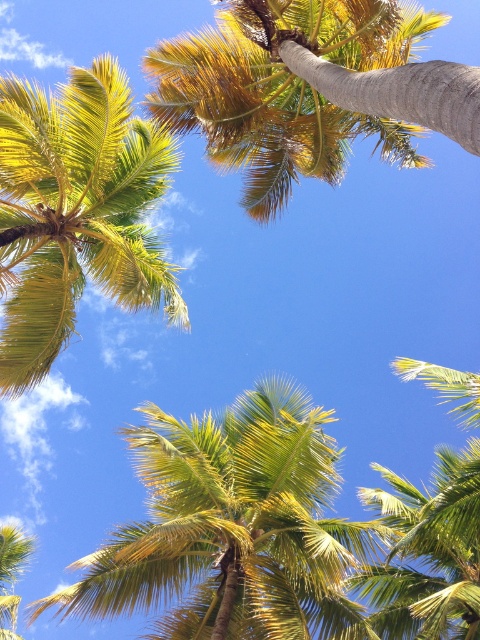
Question: Does green leafy palm at center appear over golden yellow leaves at upper left?

Choices:
 (A) no
 (B) yes

Answer: (A)

Question: Is green leafy palm at center above green leafy palm at lower left?

Choices:
 (A) no
 (B) yes

Answer: (B)

Question: Can you confirm if green leafy palm at center is positioned above green leafy palm at lower left?

Choices:
 (A) no
 (B) yes

Answer: (B)

Question: Which object is closer to the camera taking this photo?

Choices:
 (A) green leafy palm at center
 (B) green leafy palm at lower left
 (C) golden yellow leaves at upper left

Answer: (A)

Question: Which object is the closest to the green leafy coconut tree at upper center?

Choices:
 (A) golden yellow leaves at upper left
 (B) green leafy palm at lower left

Answer: (A)

Question: Among these objects, which one is farthest from the camera?

Choices:
 (A) green leafy palm at lower left
 (B) golden yellow leaves at upper left
 (C) green leafy coconut tree at upper center
 (D) green leafy palm at center

Answer: (A)